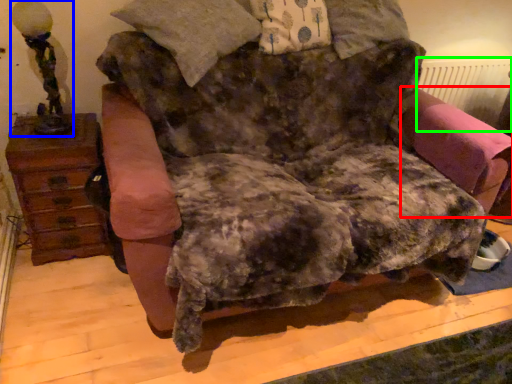
Question: Which object is the closest to the swivel chair (highlighted by a red box)? Choose among these: table lamp (highlighted by a blue box) or radiator (highlighted by a green box).

Choices:
 (A) table lamp
 (B) radiator

Answer: (B)